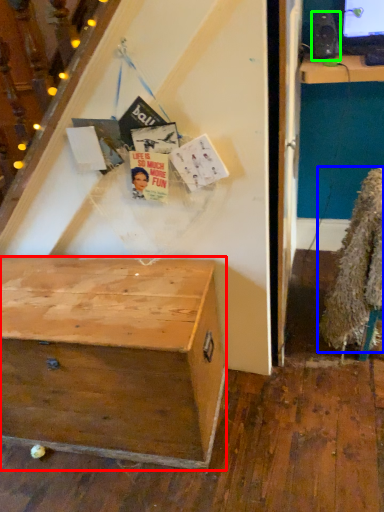
Question: Estimate the real-world distances between objects in this image. Which object is farther from desk (highlighted by a red box), fur coat (highlighted by a blue box) or loudspeaker (highlighted by a green box)?

Choices:
 (A) fur coat
 (B) loudspeaker

Answer: (B)